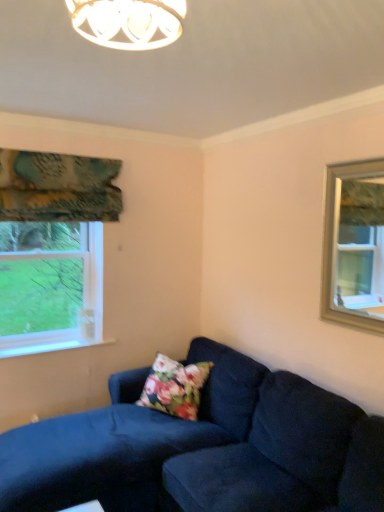
Question: Is floral fabric pillow at lower center positioned beyond the bounds of clear glass window at upper right?

Choices:
 (A) no
 (B) yes

Answer: (B)

Question: Is floral fabric pillow at lower center oriented away from clear glass window at upper right?

Choices:
 (A) no
 (B) yes

Answer: (A)

Question: Could clear glass window at upper right be considered to be inside floral fabric pillow at lower center?

Choices:
 (A) no
 (B) yes

Answer: (A)

Question: Does floral fabric pillow at lower center have a larger size compared to clear glass window at upper right?

Choices:
 (A) yes
 (B) no

Answer: (A)

Question: From the image's perspective, is floral fabric pillow at lower center above clear glass window at upper right?

Choices:
 (A) yes
 (B) no

Answer: (B)

Question: Considering the relative sizes of floral fabric pillow at lower center and clear glass window at upper right in the image provided, is floral fabric pillow at lower center wider than clear glass window at upper right?

Choices:
 (A) no
 (B) yes

Answer: (B)

Question: Is suede dark blue couch at lower right thinner than clear glass window at upper right?

Choices:
 (A) yes
 (B) no

Answer: (B)

Question: Could you tell me if suede dark blue couch at lower right is facing clear glass window at upper right?

Choices:
 (A) yes
 (B) no

Answer: (B)

Question: Is suede dark blue couch at lower right touching clear glass window at upper right?

Choices:
 (A) yes
 (B) no

Answer: (B)

Question: Is clear glass window at upper right located within suede dark blue couch at lower right?

Choices:
 (A) yes
 (B) no

Answer: (B)

Question: Can you confirm if suede dark blue couch at lower right is shorter than clear glass window at upper right?

Choices:
 (A) no
 (B) yes

Answer: (B)

Question: From a real-world perspective, is suede dark blue couch at lower right physically below clear glass window at upper right?

Choices:
 (A) yes
 (B) no

Answer: (A)

Question: From a real-world perspective, is teal floral fabric at upper left positioned over clear glass window at upper right based on gravity?

Choices:
 (A) yes
 (B) no

Answer: (A)